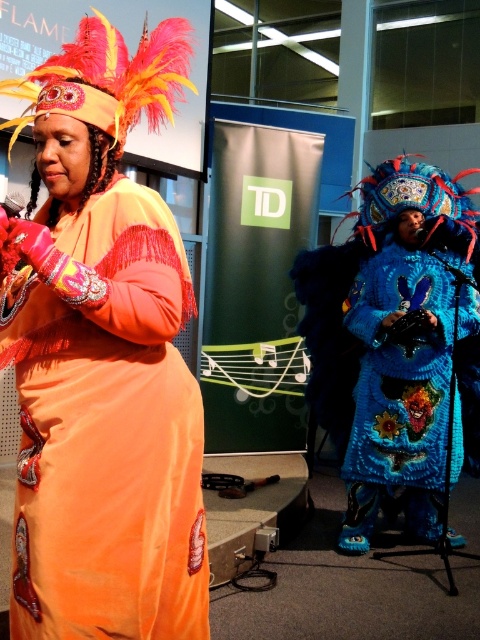
Can you confirm if velvet orange dress at center is bigger than blue knitted robe at center?

No, velvet orange dress at center is not bigger than blue knitted robe at center.

Is velvet orange dress at center smaller than blue knitted robe at center?

Yes, velvet orange dress at center is smaller than blue knitted robe at center.

You are a GUI agent. You are given a task and a screenshot of the screen. Output one action in this format:
    pyautogui.click(x=<x>, y=<y>)
    Task: Click on the velvet orange dress at center
    This screenshot has height=640, width=480.
    Given the screenshot: What is the action you would take?
    pyautogui.click(x=108, y=433)